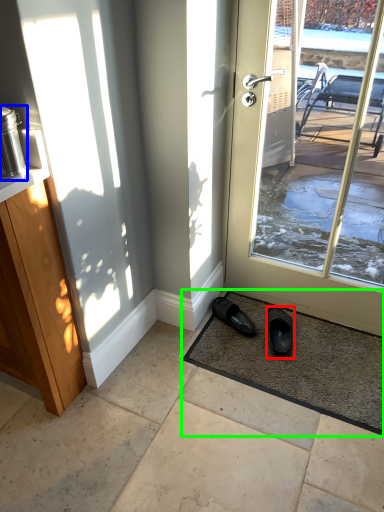
Question: Considering the real-world distances, which object is farthest from footwear (highlighted by a red box)? appliance (highlighted by a blue box) or mat (highlighted by a green box)?

Choices:
 (A) appliance
 (B) mat

Answer: (A)